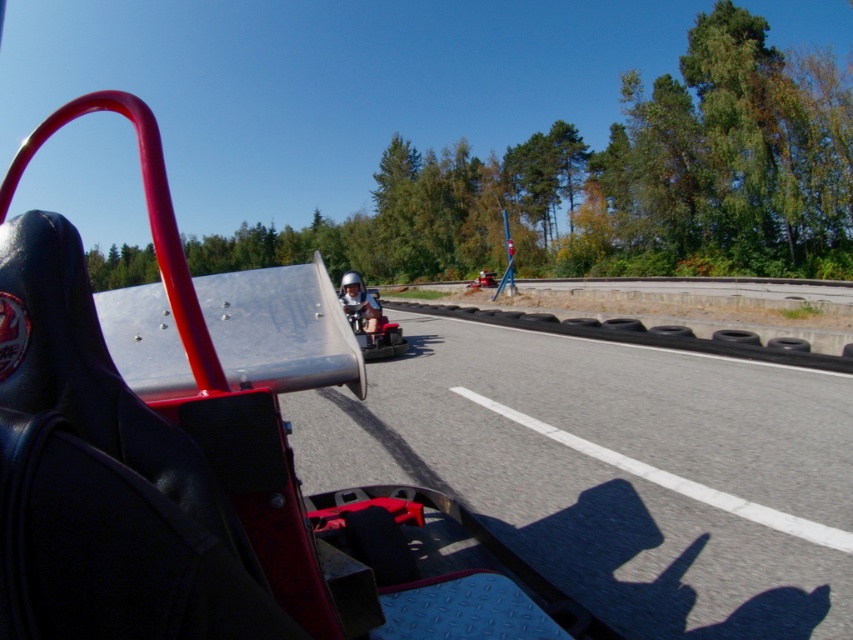
Question: Is smooth asphalt highway at center to the left of shiny silver helmet at center from the viewer's perspective?

Choices:
 (A) no
 (B) yes

Answer: (A)

Question: Among these objects, which one is nearest to the camera?

Choices:
 (A) smooth asphalt highway at center
 (B) shiny silver helmet at center

Answer: (A)

Question: Observing the image, what is the correct spatial positioning of smooth asphalt highway at center in reference to shiny silver helmet at center?

Choices:
 (A) left
 (B) right

Answer: (B)

Question: Which object appears closest to the camera in this image?

Choices:
 (A) smooth asphalt highway at center
 (B) shiny silver helmet at center

Answer: (A)

Question: Among these objects, which one is farthest from the camera?

Choices:
 (A) smooth asphalt highway at center
 (B) shiny silver helmet at center

Answer: (B)

Question: Is smooth asphalt highway at center smaller than shiny silver helmet at center?

Choices:
 (A) yes
 (B) no

Answer: (A)